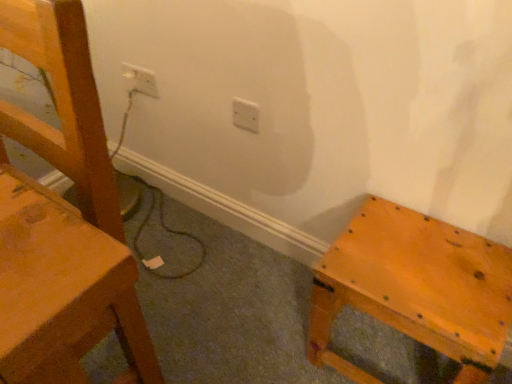
Locate an element on the screen. This screenshot has width=512, height=384. vacant area situated to the left side of matte wooden stool at lower right is located at coordinates (262, 323).